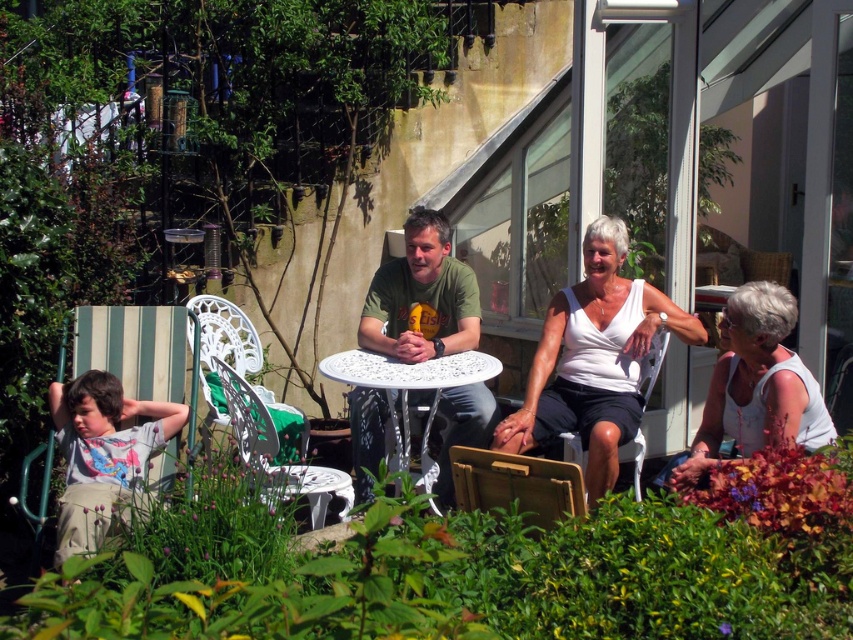
Question: Which of the following is the farthest from the observer?

Choices:
 (A) (283, 484)
 (B) (184, 420)
 (C) (469, 371)
 (D) (779, 342)

Answer: (C)

Question: Which of the following is the farthest from the observer?

Choices:
 (A) white metal table at center
 (B) white plastic chair at center

Answer: (B)

Question: In this image, where is green leafy plants at lower center located relative to white metal table at center?

Choices:
 (A) right
 (B) left

Answer: (A)

Question: Which point appears farthest from the camera in this image?

Choices:
 (A) (x=234, y=368)
 (B) (x=691, y=481)
 (C) (x=79, y=497)
 (D) (x=711, y=600)

Answer: (A)

Question: Does wooden chair at lower center appear over white textured chair at center?

Choices:
 (A) yes
 (B) no

Answer: (B)

Question: Is green matte t-shirt at center further to the viewer compared to white metal table at center?

Choices:
 (A) no
 (B) yes

Answer: (B)